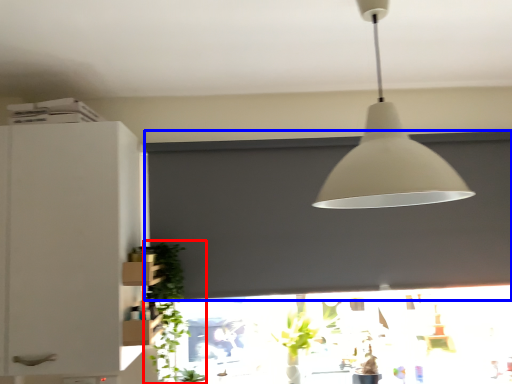
Question: Which point is further to the camera, plant (highlighted by a red box) or window screen (highlighted by a blue box)?

Choices:
 (A) plant
 (B) window screen

Answer: (B)